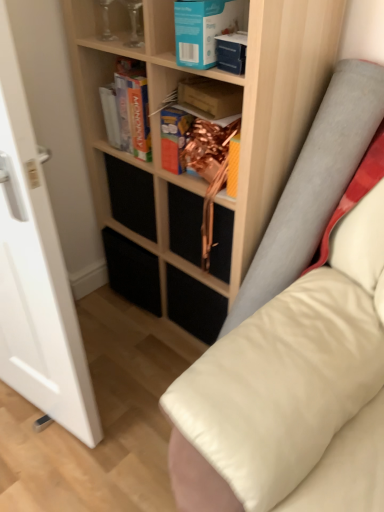
Question: Which direction should I rotate to face matte cardboard box at upper center, marked as the second paperback book in a back-to-front arrangement, — up or down?

Choices:
 (A) down
 (B) up

Answer: (B)

Question: Can matte cardboard book at center, which is the 1th paperback book from back to front, be found inside wooden shelf at center, the 2th shelf from the left?

Choices:
 (A) no
 (B) yes

Answer: (B)

Question: Can you confirm if wooden shelf at center, the 2th shelf from the left, is wider than matte cardboard book at center, which is the 1th paperback book from back to front?

Choices:
 (A) no
 (B) yes

Answer: (B)

Question: Is wooden shelf at center, the 2th shelf from the left, thinner than matte cardboard book at center, which ranks as the third paperback book in front-to-back order?

Choices:
 (A) yes
 (B) no

Answer: (B)

Question: Is wooden shelf at center, the first shelf in the right-to-left sequence, smaller than matte cardboard book at center, which ranks as the third paperback book in front-to-back order?

Choices:
 (A) no
 (B) yes

Answer: (A)

Question: Is wooden shelf at center, the 2th shelf from the left, in contact with matte cardboard book at center, which ranks as the third paperback book in front-to-back order?

Choices:
 (A) no
 (B) yes

Answer: (A)

Question: Is wooden shelf at center, the 2th shelf from the left, outside matte cardboard book at center, which is the 1th paperback book from back to front?

Choices:
 (A) yes
 (B) no

Answer: (A)

Question: Could you tell me if clear glass vase at upper left, positioned as the first shelf in left-to-right order, is turned towards black matte drawer at lower center?

Choices:
 (A) no
 (B) yes

Answer: (A)

Question: Can we say clear glass vase at upper left, positioned as the first shelf in left-to-right order, lies outside black matte drawer at lower center?

Choices:
 (A) yes
 (B) no

Answer: (A)

Question: Does clear glass vase at upper left, positioned as the first shelf in left-to-right order, have a lesser width compared to black matte drawer at lower center?

Choices:
 (A) yes
 (B) no

Answer: (A)

Question: Can you confirm if clear glass vase at upper left, positioned as the first shelf in left-to-right order, is taller than black matte drawer at lower center?

Choices:
 (A) no
 (B) yes

Answer: (A)

Question: From a real-world perspective, is clear glass vase at upper left, positioned as the first shelf in left-to-right order, beneath black matte drawer at lower center?

Choices:
 (A) no
 (B) yes

Answer: (A)

Question: From a real-world perspective, is clear glass vase at upper left, the 2th shelf from the right, positioned under blue cardboard book at upper center, the first paperback book viewed from the front, based on gravity?

Choices:
 (A) no
 (B) yes

Answer: (A)